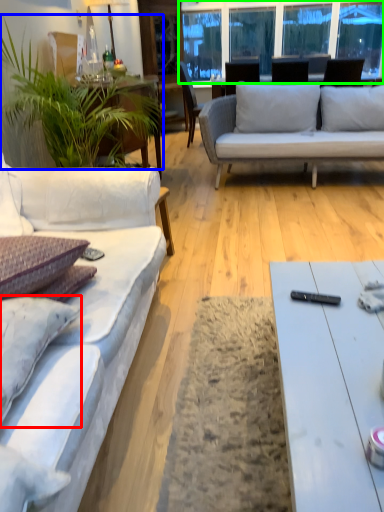
Question: Which is nearer to the pillow (highlighted by a red box)? houseplant (highlighted by a blue box) or window screen (highlighted by a green box).

Choices:
 (A) houseplant
 (B) window screen

Answer: (A)